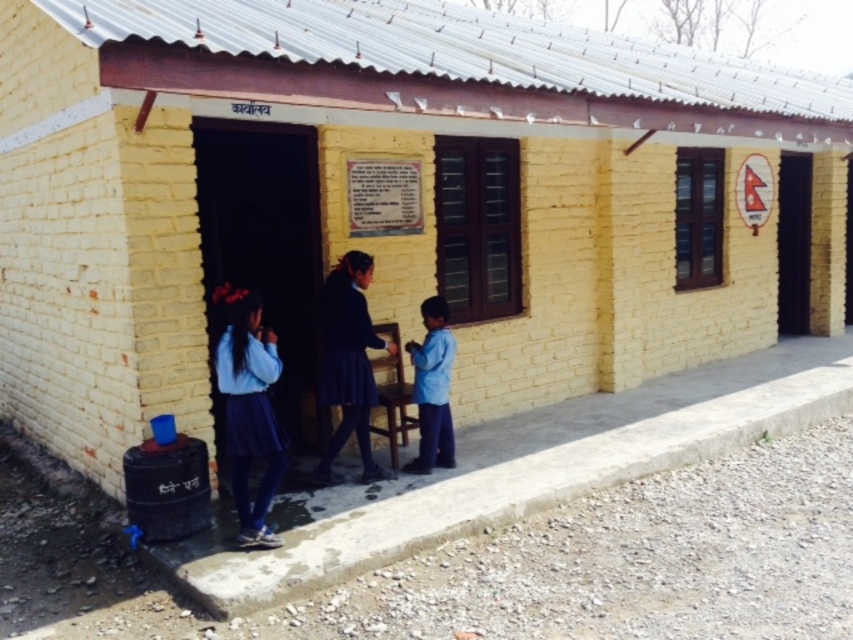
Consider the image. Is dark blue skirt at center taller than blue cotton shirt at lower center?

Correct, dark blue skirt at center is much taller as blue cotton shirt at lower center.

Can you confirm if dark blue skirt at center is shorter than blue cotton shirt at lower center?

In fact, dark blue skirt at center may be taller than blue cotton shirt at lower center.

Locate an element on the screen. Image resolution: width=853 pixels, height=640 pixels. dark blue skirt at center is located at coordinates (347, 362).

Looking at this image, does matte blue skirt at lower left appear on the right side of dark blue skirt at center?

No, matte blue skirt at lower left is not to the right of dark blue skirt at center.

Is point (231, 289) farther from camera compared to point (331, 268)?

No, (231, 289) is closer to viewer.

Where is `matte blue skirt at lower left`? matte blue skirt at lower left is located at coordinates (248, 406).

Which is more to the left, matte blue skirt at lower left or blue cotton shirt at lower center?

matte blue skirt at lower left is more to the left.

Is point (245, 307) in front of point (448, 465)?

Yes, it is.

Does point (273, 456) come behind point (428, 392)?

No, it is in front of (428, 392).

In order to click on matte blue skirt at lower left in this screenshot , I will do [248, 406].